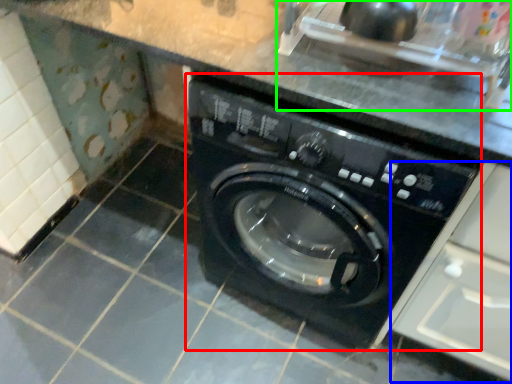
Question: Estimate the real-world distances between objects in this image. Which object is closer to washing machine (highlighted by a red box), drawer (highlighted by a blue box) or sink (highlighted by a green box)?

Choices:
 (A) drawer
 (B) sink

Answer: (A)